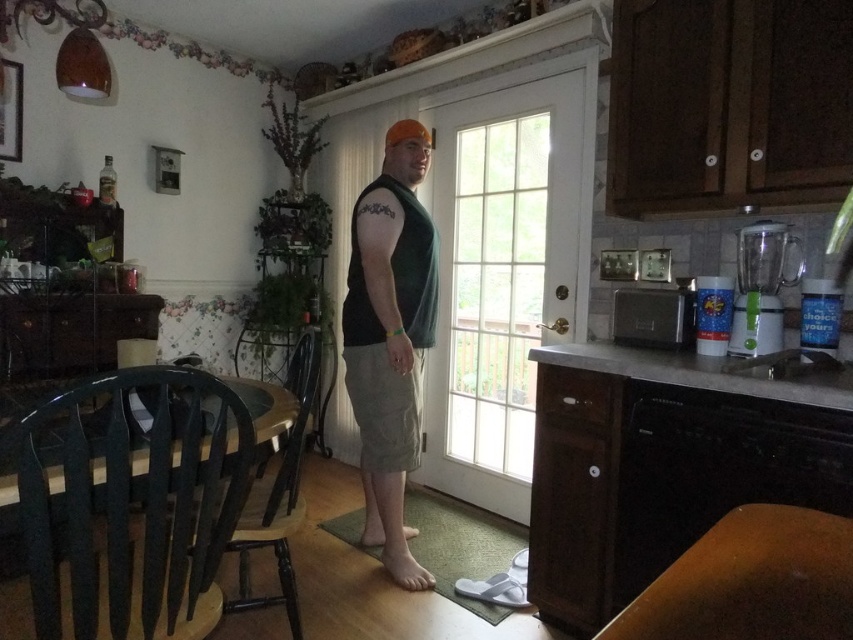
Does green matte tank top at center have a smaller size compared to black plastic chair at left?

No.

Does green matte tank top at center appear under black plastic chair at left?

No.

You are a GUI agent. You are given a task and a screenshot of the screen. Output one action in this format:
    pyautogui.click(x=<x>, y=<y>)
    Task: Click on the green matte tank top at center
    The width and height of the screenshot is (853, 640).
    Given the screenshot: What is the action you would take?
    pyautogui.click(x=390, y=339)

Which is above, clear glass door at center or green plastic chair at lower left?

clear glass door at center is above.

Is point (451, 310) closer to camera compared to point (189, 444)?

No, it is behind (189, 444).

Identify the location of clear glass door at center. The height and width of the screenshot is (640, 853). (503, 275).

Does clear glass door at center have a larger size compared to black plastic chair at left?

Indeed, clear glass door at center has a larger size compared to black plastic chair at left.

Does clear glass door at center lie behind black plastic chair at left?

Yes.

Is point (432, 120) farther from viewer compared to point (270, 541)?

Yes, point (432, 120) is farther from viewer.

Find the location of `clear glass door at center`. clear glass door at center is located at coordinates (503, 275).